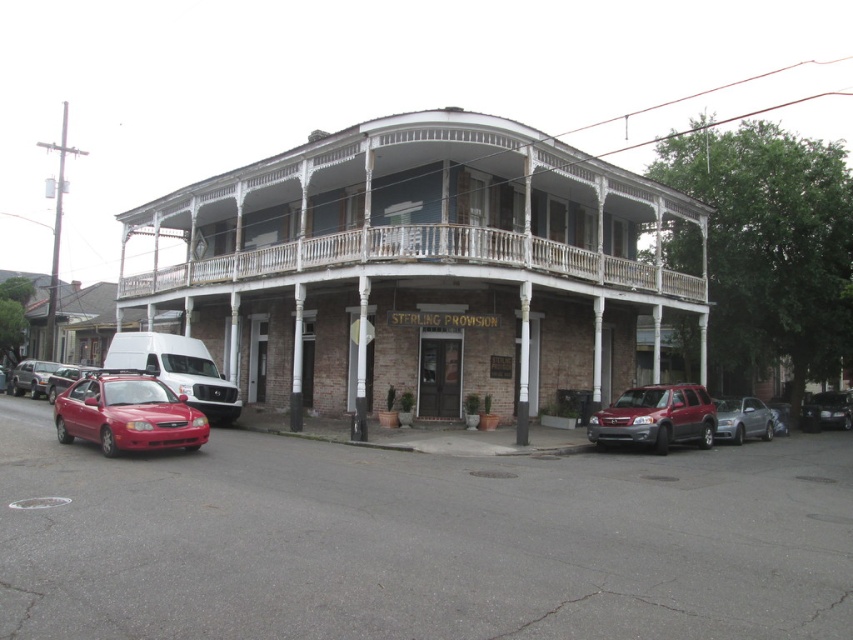
Question: Among these points, which one is farthest from the camera?

Choices:
 (A) (28, 381)
 (B) (595, 276)
 (C) (811, 424)

Answer: (A)

Question: Does white wooden balcony at upper center lie in front of matte red sedan at lower left?

Choices:
 (A) no
 (B) yes

Answer: (B)

Question: Does white wood balcony at center appear under shiny red sedan at lower left?

Choices:
 (A) no
 (B) yes

Answer: (A)

Question: Which object is the closest to the matte red sedan at lower left?

Choices:
 (A) white wood balcony at center
 (B) satin silver sedan at center
 (C) shiny black suv at lower right
 (D) metallic silver sedan at left

Answer: (D)

Question: Which object is positioned closest to the metallic silver sedan at left?

Choices:
 (A) shiny black suv at lower right
 (B) shiny red sedan at lower left
 (C) satin silver sedan at center

Answer: (B)

Question: Is shiny black suv at lower right smaller than matte red sedan at lower left?

Choices:
 (A) no
 (B) yes

Answer: (A)